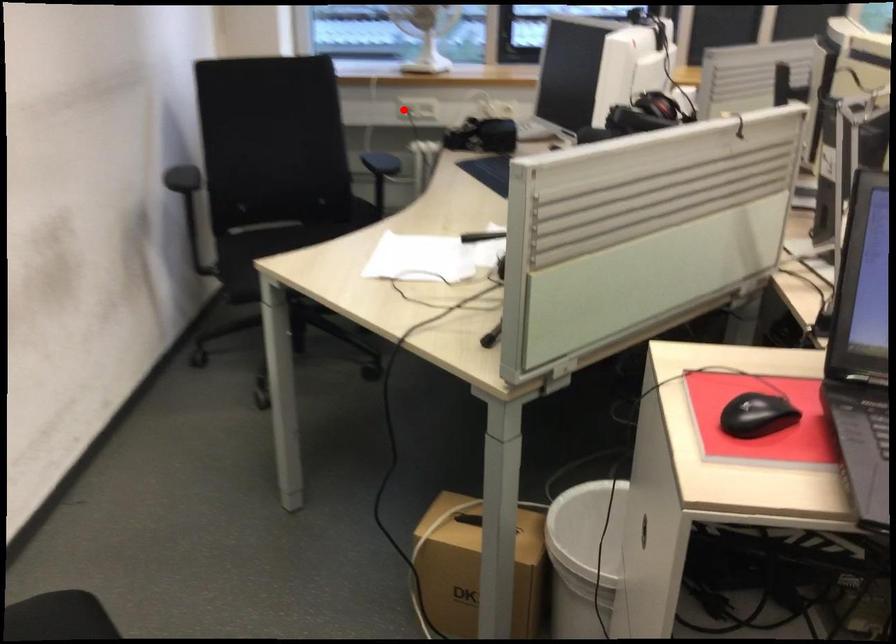
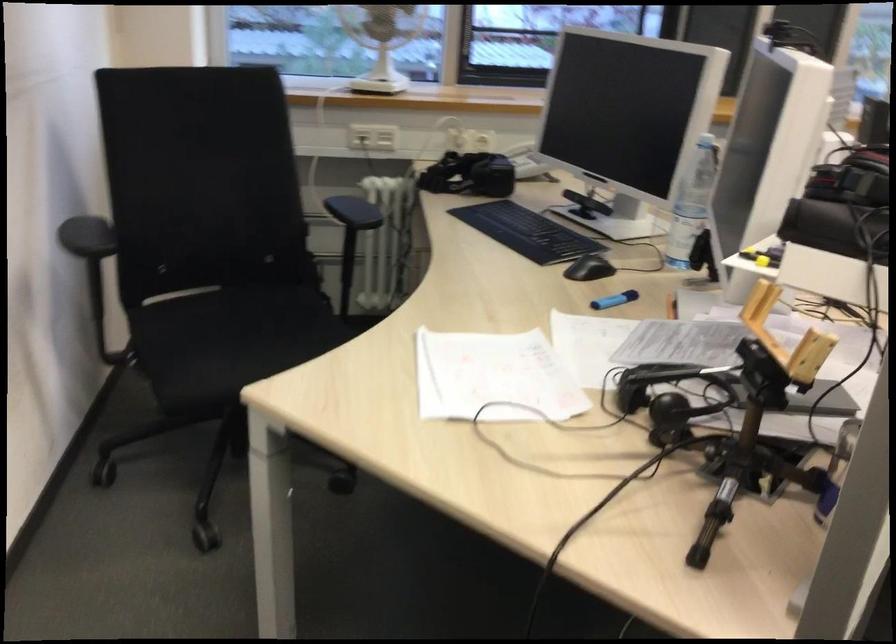
Question: I am providing you with two images of the same scene from different viewpoints. A red point is shown in image1. For the corresponding object point in image2, is it positioned nearer or farther from the camera?

Choices:
 (A) Nearer
 (B) Farther

Answer: (A)